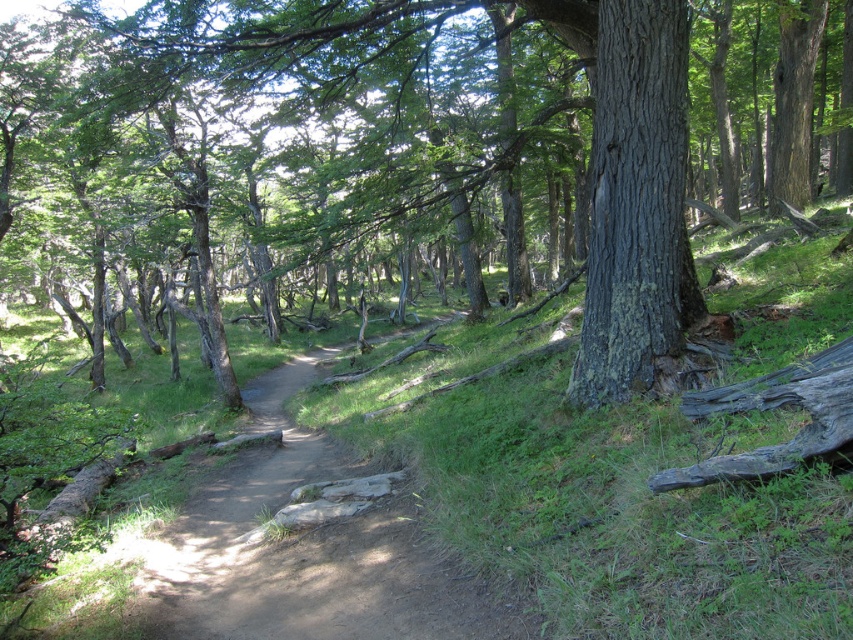
You are a hiker walking along the dirt path in the forest. You notice a dark gray bark tree at center and a charcoal rough log at right. Which object is closer to you as you walk the path?

The dark gray bark tree at center is closer to you because it is positioned further to the viewer than the charcoal rough log at right, meaning it appears nearer in your line of sight.

You are standing in the forest and want to reach the rough bark tree at center. Given that your average walking pace is 3 feet per second, how many seconds will it take you to reach the tree?

The distance between you and the rough bark tree at center is 21.05 feet. At a walking pace of 3 feet per second, it would take approximately 7 seconds to reach the tree.

You are a hiker walking along the dirt path in the forest. You see a rough bark tree at center and a charcoal rough log at right. Which object is farther from your current position?

The charcoal rough log at right is farther from your current position because it is positioned behind the rough bark tree at center.